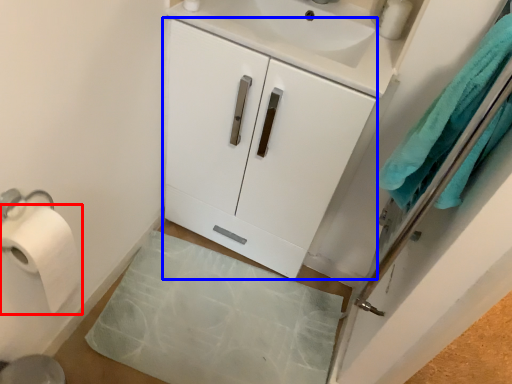
Question: Which point is further to the camera, toilet paper (highlighted by a red box) or cabinetry (highlighted by a blue box)?

Choices:
 (A) toilet paper
 (B) cabinetry

Answer: (B)